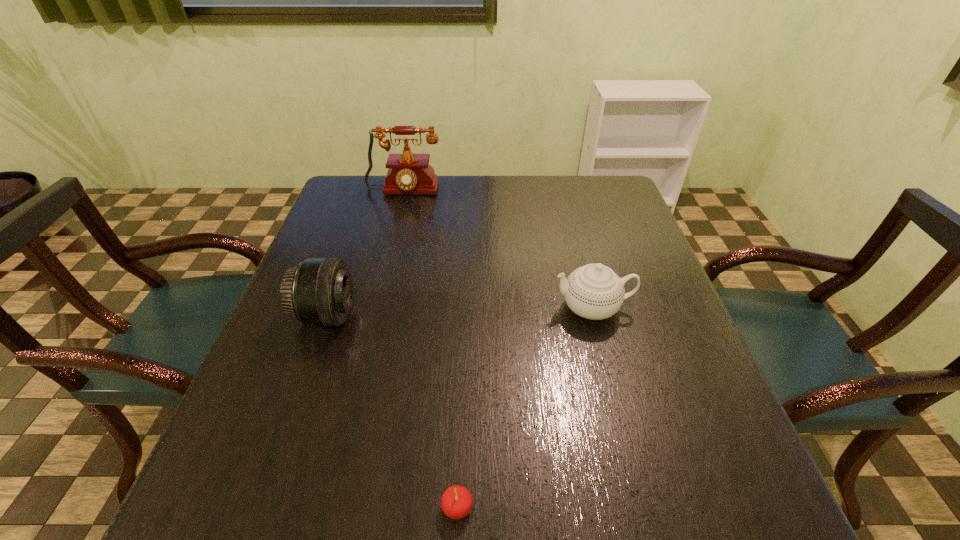
Image resolution: width=960 pixels, height=540 pixels. I want to click on free spot that satisfies the following two spatial constraints: 1. on the dial of the farthest object; 2. on the left side of the cherry, so click(325, 508).

The width and height of the screenshot is (960, 540). Find the location of `blank area in the image that satisfies the following two spatial constraints: 1. on the front-facing side of the telephoto lens; 2. on the right side of the cherry`. blank area in the image that satisfies the following two spatial constraints: 1. on the front-facing side of the telephoto lens; 2. on the right side of the cherry is located at coordinates (259, 508).

The width and height of the screenshot is (960, 540). Identify the location of vacant space that satisfies the following two spatial constraints: 1. on the dial of the farthest object; 2. on the front-facing side of the telephoto lens. (372, 315).

Where is `blank area in the image that satisfies the following two spatial constraints: 1. on the front-facing side of the telephoto lens; 2. on the left side of the cherry`? This screenshot has width=960, height=540. blank area in the image that satisfies the following two spatial constraints: 1. on the front-facing side of the telephoto lens; 2. on the left side of the cherry is located at coordinates (259, 508).